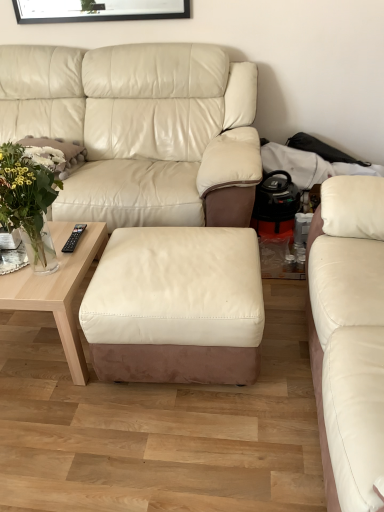
This screenshot has height=512, width=384. I want to click on vacant space in front of white leather ottoman at center, so click(177, 443).